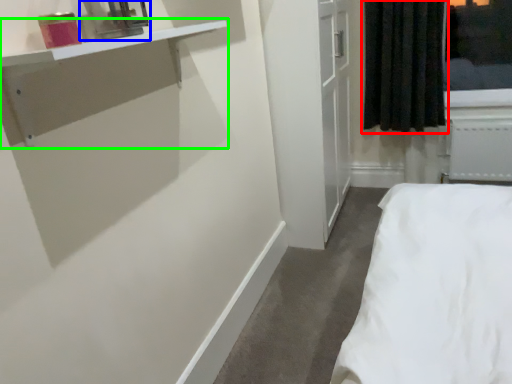
Question: Considering the real-world distances, which object is farthest from curtain (highlighted by a red box)? medicine cabinet (highlighted by a blue box) or vanity (highlighted by a green box)?

Choices:
 (A) medicine cabinet
 (B) vanity

Answer: (A)